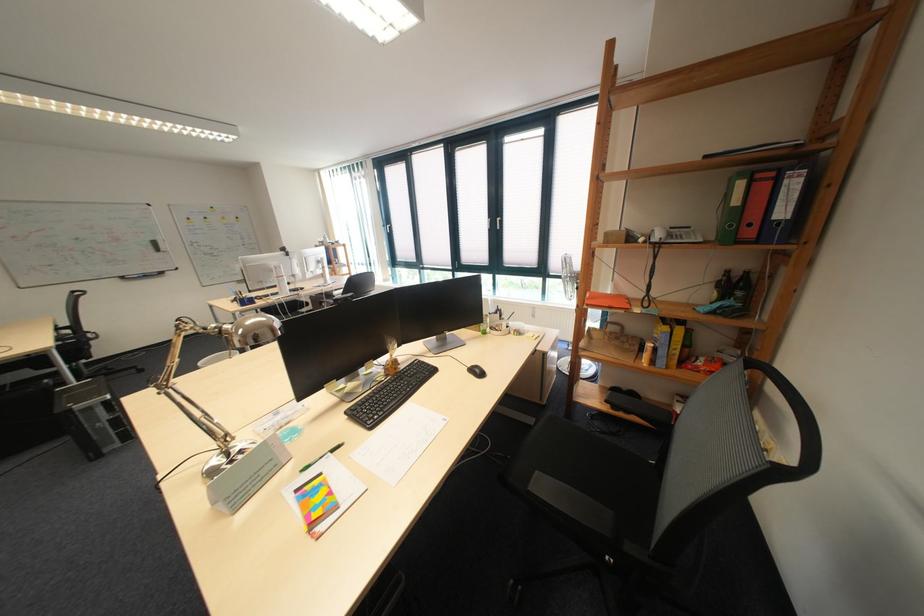
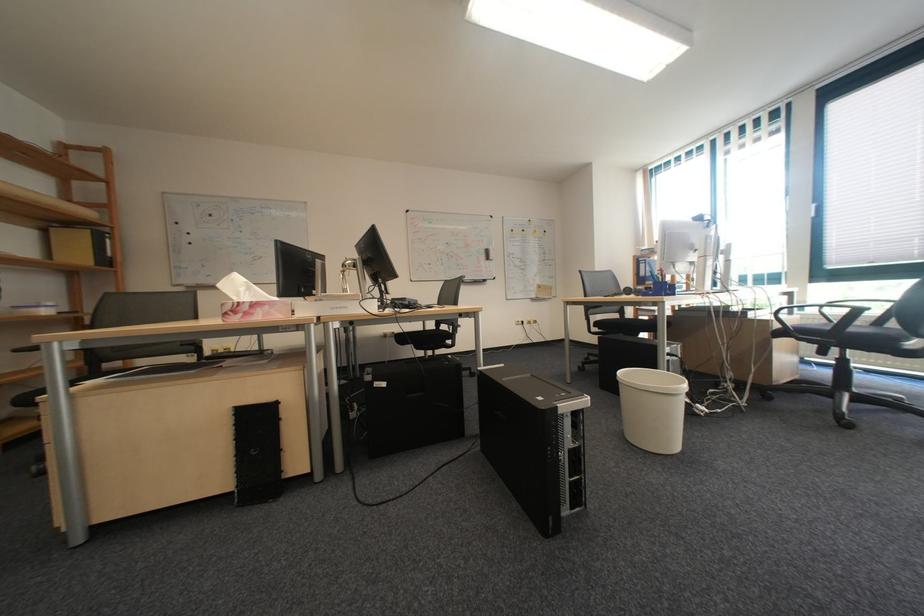
Where in the second image is the point corresponding to pixel 153 369 from the first image?

(487, 371)